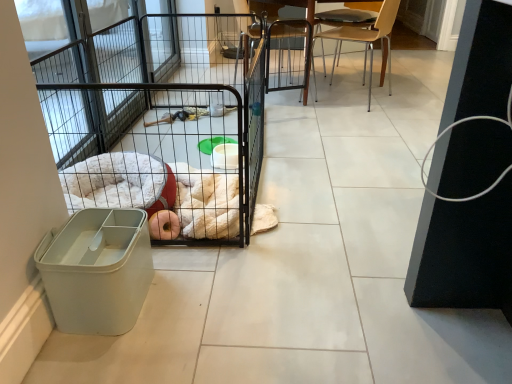
Question: From the image's perspective, does light brown wooden chair at upper right, which appears as the second chair when viewed from the left, appear lower than black wire cage at center?

Choices:
 (A) yes
 (B) no

Answer: (B)

Question: From the image's perspective, would you say light brown wooden chair at upper right, which appears as the second chair when viewed from the left, is positioned over black wire cage at center?

Choices:
 (A) no
 (B) yes

Answer: (B)

Question: Is light brown wooden chair at upper right, the 1th chair when ordered from right to left, next to black wire cage at center?

Choices:
 (A) yes
 (B) no

Answer: (B)

Question: Could you tell me if light brown wooden chair at upper right, the 1th chair when ordered from right to left, is facing black wire cage at center?

Choices:
 (A) yes
 (B) no

Answer: (B)

Question: Is light brown wooden chair at upper right, the 1th chair when ordered from right to left, facing away from black wire cage at center?

Choices:
 (A) no
 (B) yes

Answer: (A)

Question: Is light brown wooden chair at upper right, the 1th chair when ordered from right to left, at the right side of black wire cage at center?

Choices:
 (A) no
 (B) yes

Answer: (B)

Question: From the image's perspective, is wooden chair at center, arranged as the 2th chair when viewed from the right, under light brown wooden chair at upper right, which appears as the second chair when viewed from the left?

Choices:
 (A) no
 (B) yes

Answer: (A)

Question: From a real-world perspective, is wooden chair at center, which appears as the first chair when viewed from the left, on light brown wooden chair at upper right, the 1th chair when ordered from right to left?

Choices:
 (A) no
 (B) yes

Answer: (A)

Question: Is wooden chair at center, which appears as the first chair when viewed from the left, at the right side of light brown wooden chair at upper right, which appears as the second chair when viewed from the left?

Choices:
 (A) yes
 (B) no

Answer: (B)

Question: Is wooden chair at center, which appears as the first chair when viewed from the left, positioned behind light brown wooden chair at upper right, the 1th chair when ordered from right to left?

Choices:
 (A) yes
 (B) no

Answer: (A)

Question: Does wooden chair at center, arranged as the 2th chair when viewed from the right, have a greater height compared to light brown wooden chair at upper right, the 1th chair when ordered from right to left?

Choices:
 (A) yes
 (B) no

Answer: (A)

Question: Does wooden chair at center, which appears as the first chair when viewed from the left, have a larger size compared to light brown wooden chair at upper right, which appears as the second chair when viewed from the left?

Choices:
 (A) no
 (B) yes

Answer: (B)

Question: From the image's perspective, is light brown wooden chair at upper right, the 1th chair when ordered from right to left, located above wooden chair at center, which appears as the first chair when viewed from the left?

Choices:
 (A) yes
 (B) no

Answer: (B)